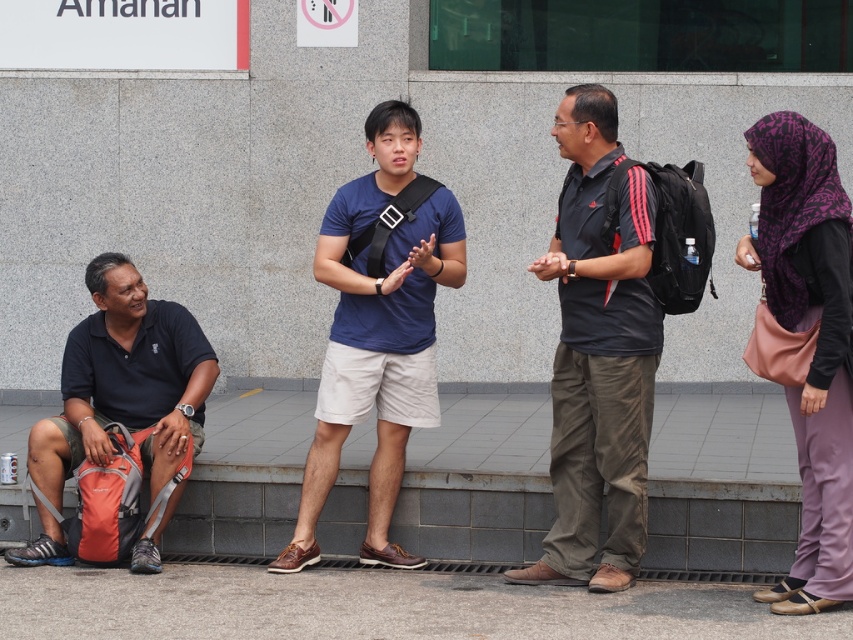
You are standing at the camera position and want to place a 2 meter long banner on the gray concrete pavement at lower center. Is there enough space for the banner?

The gray concrete pavement at lower center is 5.92 meters away from camera. Since the banner is only 2 meters long, there is sufficient space to place it there.

You are standing at the center of the image and want to place a small marker at the gray concrete pavement at lower center. What are the coordinates where you should place the marker?

The coordinates for the gray concrete pavement at lower center are at point (374, 605).

You are a photographer trying to capture a closeup of the purple printed hijab at upper right. Based on its 2D coordinates, where should you position your camera in relation to the scene?

The purple printed hijab at upper right is located at coordinates 0.534 on the x axis and 0.955 on the y axis, meaning it is positioned near the upper right corner of the scene. To capture a closeup, you should position your camera towards the upper right area of the scene.